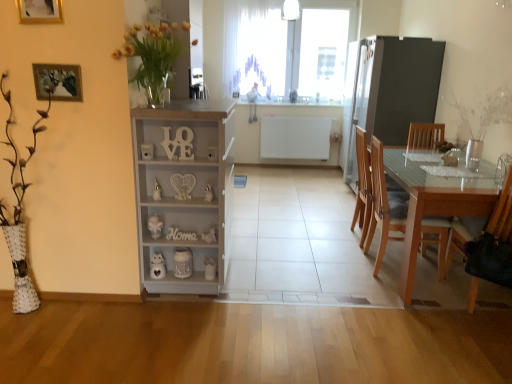
Question: Considering the relative positions of light brown wood chair at right, the second chair viewed from the back, and yellow glass vase at upper left in the image provided, is light brown wood chair at right, the second chair viewed from the back, to the right of yellow glass vase at upper left from the viewer's perspective?

Choices:
 (A) no
 (B) yes

Answer: (B)

Question: Are light brown wood chair at right, acting as the 2th chair starting from the front, and yellow glass vase at upper left located far from each other?

Choices:
 (A) yes
 (B) no

Answer: (A)

Question: Is light brown wood chair at right, acting as the 2th chair starting from the front, located outside yellow glass vase at upper left?

Choices:
 (A) yes
 (B) no

Answer: (A)

Question: Can you confirm if light brown wood chair at right, the second chair viewed from the back, is positioned to the left of yellow glass vase at upper left?

Choices:
 (A) yes
 (B) no

Answer: (B)

Question: Considering the relative sizes of light brown wood chair at right, the second chair viewed from the back, and yellow glass vase at upper left in the image provided, is light brown wood chair at right, the second chair viewed from the back, smaller than yellow glass vase at upper left?

Choices:
 (A) yes
 (B) no

Answer: (B)

Question: From the image's perspective, does light brown wood chair at right, the second chair viewed from the back, appear lower than yellow glass vase at upper left?

Choices:
 (A) yes
 (B) no

Answer: (A)

Question: Is transparent glass window at upper center to the left of light brown wood chair at right, placed as the third chair when sorted from front to back, from the viewer's perspective?

Choices:
 (A) no
 (B) yes

Answer: (B)

Question: Can you confirm if transparent glass window at upper center is taller than light brown wood chair at right, acting as the 1th chair starting from the back?

Choices:
 (A) no
 (B) yes

Answer: (B)

Question: Does transparent glass window at upper center appear on the right side of light brown wood chair at right, acting as the 1th chair starting from the back?

Choices:
 (A) no
 (B) yes

Answer: (A)

Question: Is transparent glass window at upper center far from light brown wood chair at right, placed as the third chair when sorted from front to back?

Choices:
 (A) no
 (B) yes

Answer: (B)

Question: Considering the relative sizes of transparent glass window at upper center and light brown wood chair at right, placed as the third chair when sorted from front to back, in the image provided, is transparent glass window at upper center shorter than light brown wood chair at right, placed as the third chair when sorted from front to back,?

Choices:
 (A) yes
 (B) no

Answer: (B)

Question: Is transparent glass window at upper center thinner than light brown wood chair at right, acting as the 1th chair starting from the back?

Choices:
 (A) no
 (B) yes

Answer: (B)

Question: Is transparent glass table at right positioned with its back to yellow glass vase at upper left?

Choices:
 (A) yes
 (B) no

Answer: (B)